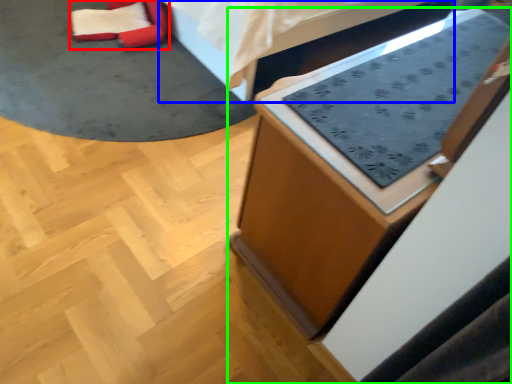
Question: Estimate the real-world distances between objects in this image. Which object is farther from bean bag chair (highlighted by a red box), furniture (highlighted by a blue box) or furniture (highlighted by a green box)?

Choices:
 (A) furniture
 (B) furniture

Answer: (B)